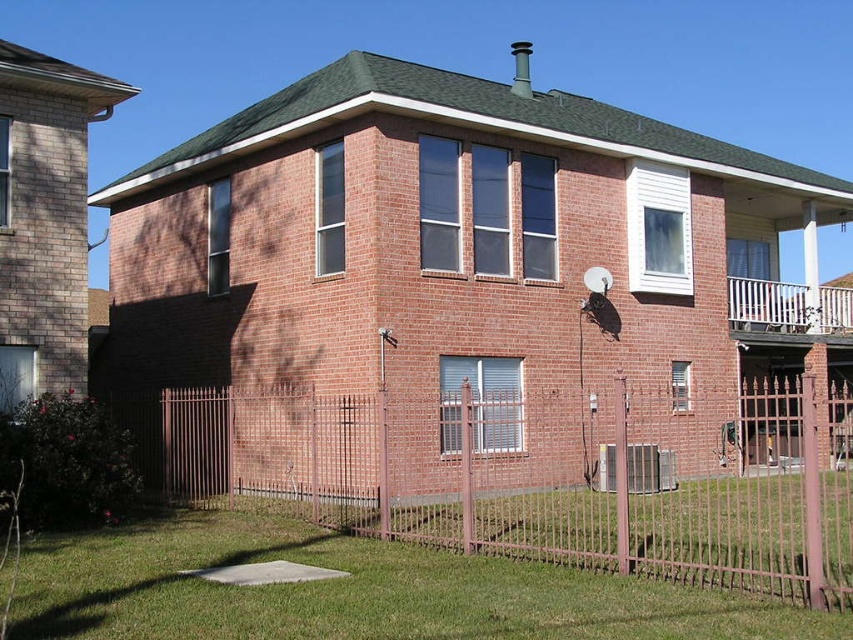
Between green grass at lower center and metallic silver basketball hoop at upper right, which one is positioned lower?

green grass at lower center is lower down.

Identify the location of green grass at lower center. 358,592.

Does brown wrought iron fence at lower center come in front of metallic silver basketball hoop at upper right?

Yes, brown wrought iron fence at lower center is in front of metallic silver basketball hoop at upper right.

At what (x,y) coordinates should I click in order to perform the action: click on brown wrought iron fence at lower center. Please return your answer as a coordinate pair (x, y). This screenshot has height=640, width=853. Looking at the image, I should click on (544, 474).

Does point (819, 392) lie behind point (283, 589)?

Yes, point (819, 392) is farther from viewer.

Does brown wrought iron fence at lower center appear over green grass at lower center?

Indeed, brown wrought iron fence at lower center is positioned over green grass at lower center.

Find the location of a particular element. The image size is (853, 640). brown wrought iron fence at lower center is located at coordinates (544, 474).